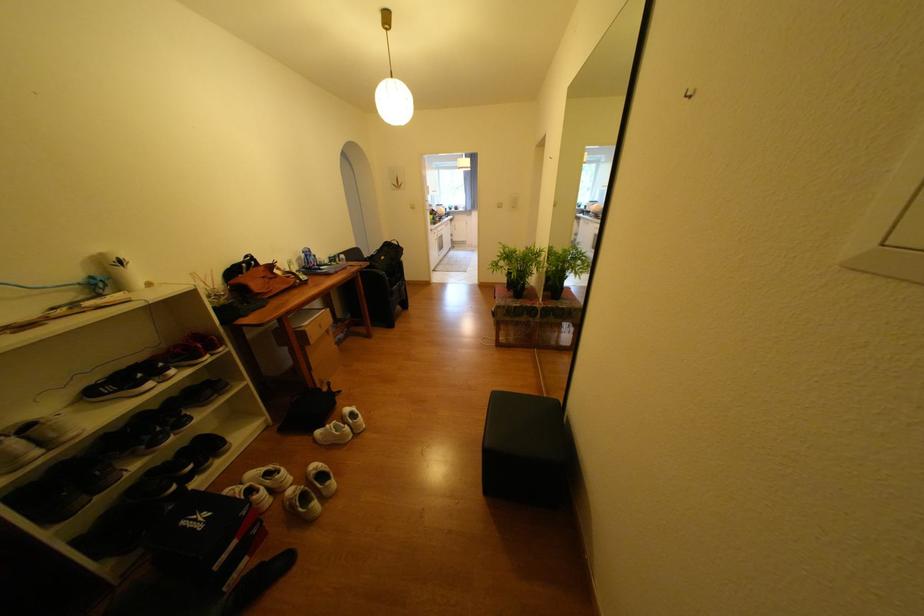
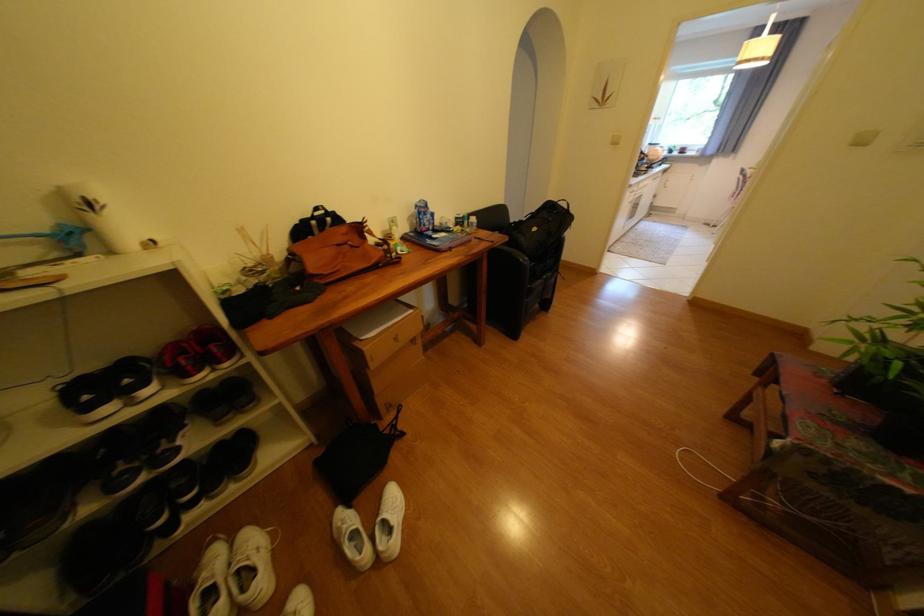
The point at (315, 256) is marked in the first image. Where is the corresponding point in the second image?

(429, 214)